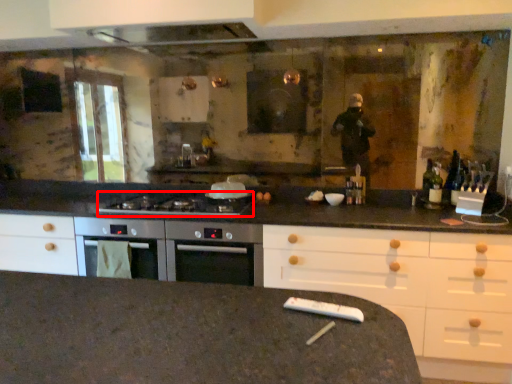
Question: From the image's perspective, where is gas stove (annotated by the red box) located relative to appliance?

Choices:
 (A) above
 (B) below

Answer: (A)